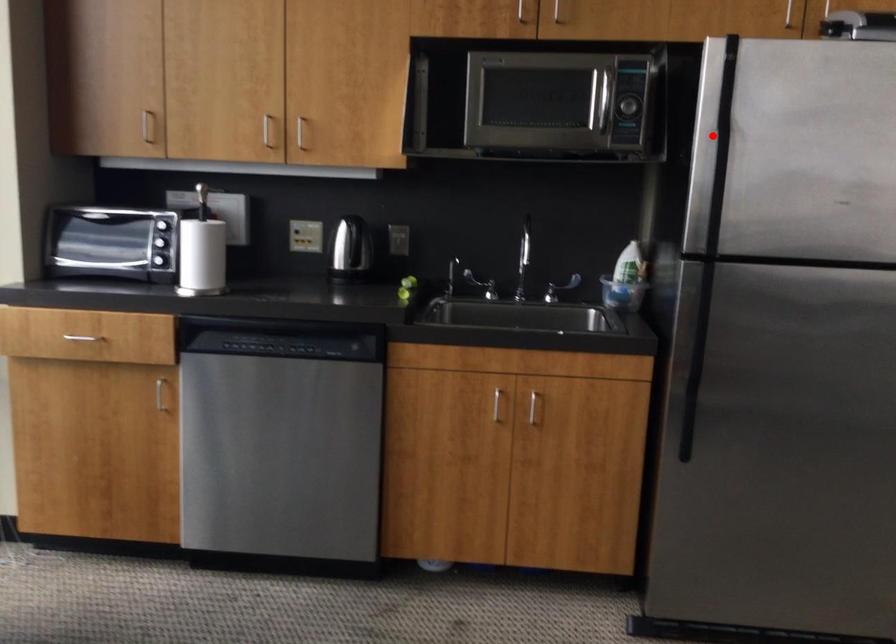
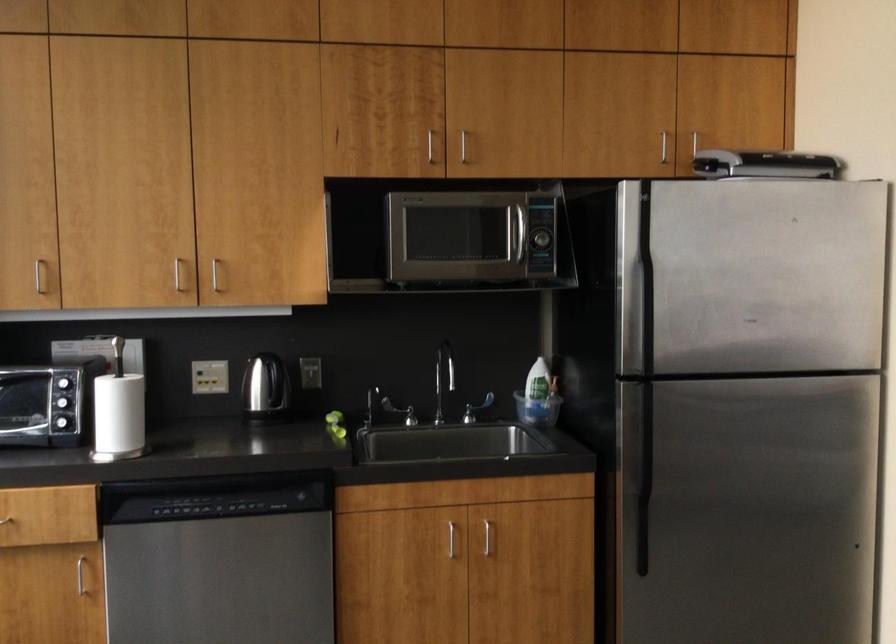
Question: I am providing you with two images of the same scene from different viewpoints. Image1 has a red point marked. In image2, the corresponding 3D location appears at what relative position? Reply with the corresponding letter.

Choices:
 (A) Closer
 (B) Farther

Answer: (B)